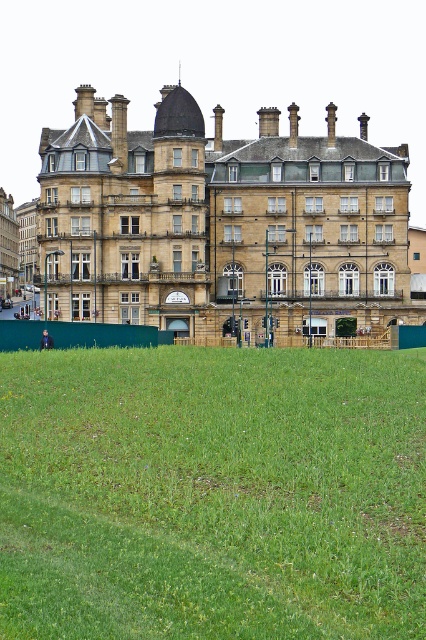
You are standing in a park and see the green grass at lower center and the brown stone building at center. Which one is closer to you?

The green grass at lower center is closer to you because it is smaller than the brown stone building at center, which is further away.

Consider the image. You are standing in a park and see the green grass at lower center and the brown stone building at center. Which one is closer to the ground?

The green grass at lower center is closer to the ground as it is located below the brown stone building at center.